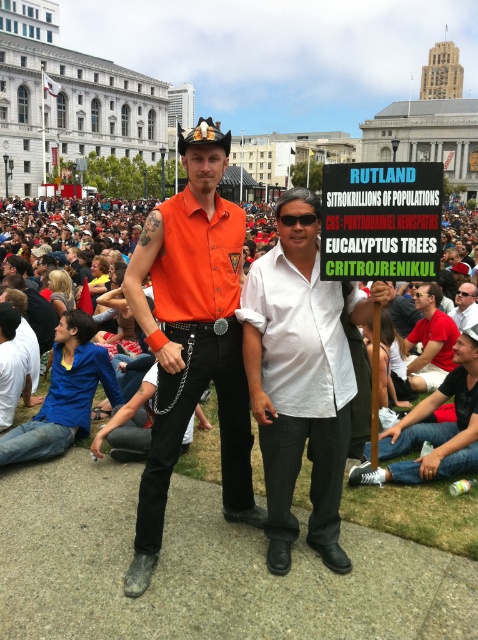
You are a photographer standing at the edge of the crowd in the city square. You want to take a photo of both the orange matte shirt at center and the matte orange shirt at center. Can you fit both subjects in the frame if your camera has a 10 meter field of view?

The orange matte shirt at center is 19.87 meters away from the matte orange shirt at center. Since your camera has a 10 meter field of view, which is shorter than the distance between them, you cannot fit both subjects in the frame.

Looking at this image, you are standing at the edge of the crowd in the city square. You need to locate the white matte shirt at center. According to the coordinates provided, where exactly should you look?

You should look at point 0.669 on the x axis and 0.910 on the y axis to find the white matte shirt at center.